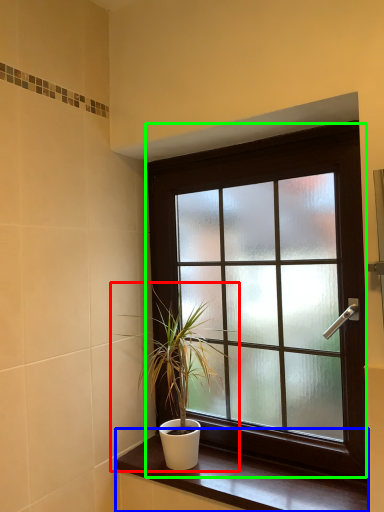
Question: Which object is the closest to the houseplant (highlighted by a red box)? Choose among these: window sill (highlighted by a blue box) or window (highlighted by a green box).

Choices:
 (A) window sill
 (B) window

Answer: (B)